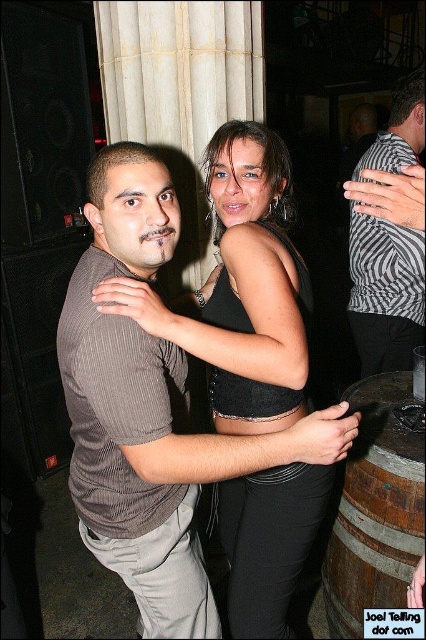
Who is taller, brown wooden barrel at lower right or zebra-striped shirt at center?

zebra-striped shirt at center

Is point (391, 538) farther from camera compared to point (420, 124)?

No, it is not.

What do you see at coordinates (376, 508) in the screenshot? This screenshot has width=426, height=640. I see `brown wooden barrel at lower right` at bounding box center [376, 508].

Locate an element on the screen. Image resolution: width=426 pixels, height=640 pixels. brown wooden barrel at lower right is located at coordinates (376, 508).

Is point (189, 561) farther from camera compared to point (408, 292)?

No, it is in front of (408, 292).

Is point (141, 227) positioned in front of point (376, 236)?

Yes, it is.

Locate an element on the screen. This screenshot has width=426, height=640. brown striped shirt at center is located at coordinates tap(152, 410).

Is brown striped shirt at center smaller than brown wooden barrel at lower right?

Actually, brown striped shirt at center might be larger than brown wooden barrel at lower right.

Can you confirm if brown striped shirt at center is positioned to the right of brown wooden barrel at lower right?

In fact, brown striped shirt at center is to the left of brown wooden barrel at lower right.

Is point (169, 474) farther from camera compared to point (360, 616)?

No.

Image resolution: width=426 pixels, height=640 pixels. Identify the location of brown striped shirt at center. (152, 410).